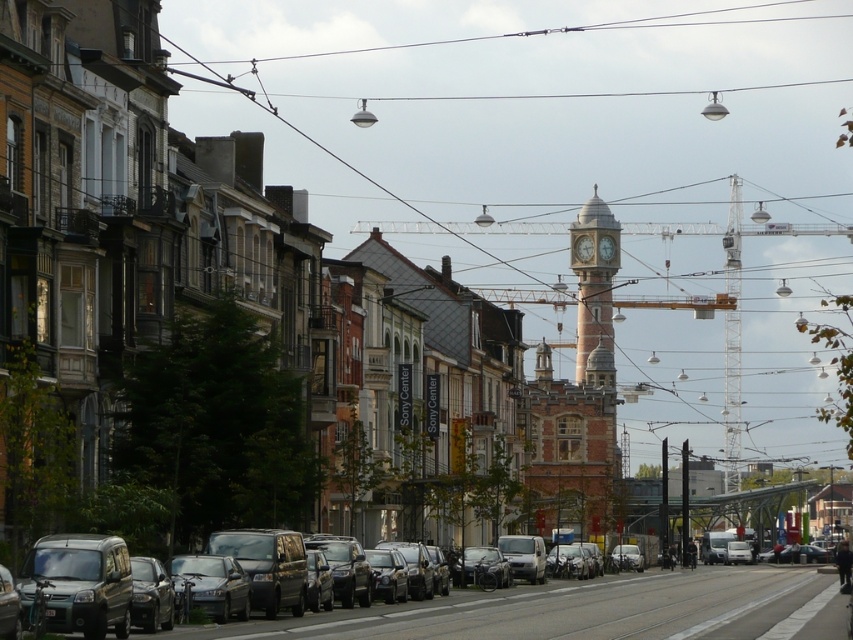
Is metallic construction crane at center in front of brick clock tower at center?

That is True.

At what (x,y) coordinates should I click in order to perform the action: click on metallic construction crane at center. Please return your answer as a coordinate pair (x, y). This screenshot has width=853, height=640. Looking at the image, I should click on (619, 266).

Who is positioned more to the right, metallic gray van at lower left or brick clock tower at center?

Positioned to the right is brick clock tower at center.

Who is more distant from viewer, (595, 604) or (590, 264)?

Point (590, 264)

Is point (604, 625) closer to camera compared to point (610, 266)?

Yes, it is in front of point (610, 266).

Where is `metallic gray van at lower left`? The height and width of the screenshot is (640, 853). metallic gray van at lower left is located at coordinates tap(546, 611).

Which is above, metallic gray van at lower left or matte black van at lower left?

matte black van at lower left

Who is more distant from viewer, (616, 584) or (53, 554)?

Point (616, 584)

Is point (482, 605) farther from camera compared to point (117, 609)?

Yes, point (482, 605) is behind point (117, 609).

The width and height of the screenshot is (853, 640). What are the coordinates of `metallic gray van at lower left` in the screenshot? It's located at (546, 611).